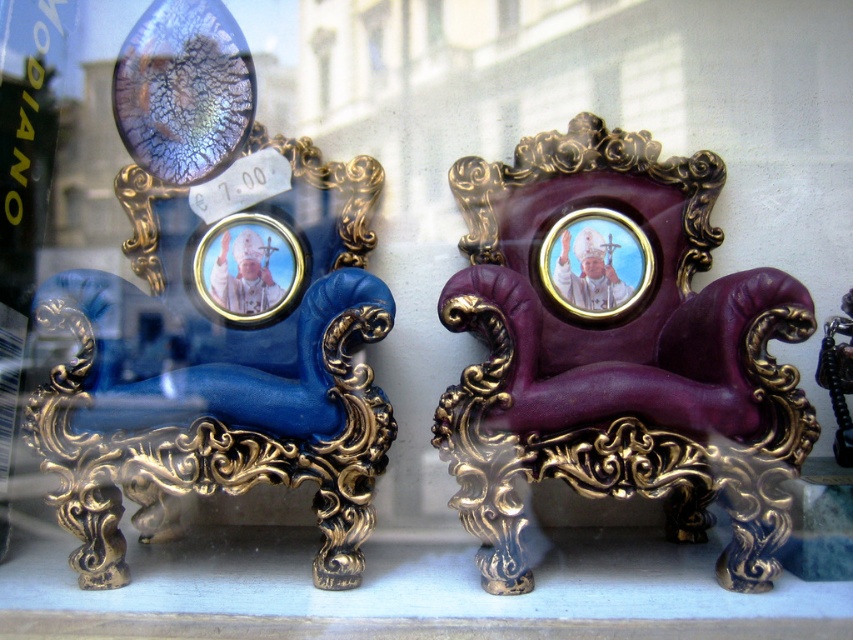
Question: Is purple leather armchair at center to the left of gold metallic picture frame at center from the viewer's perspective?

Choices:
 (A) yes
 (B) no

Answer: (B)

Question: Which object is closer to the camera taking this photo?

Choices:
 (A) purple leather armchair at center
 (B) gold metallic picture frame at center

Answer: (A)

Question: Which of the following is the closest to the observer?

Choices:
 (A) (611, 346)
 (B) (218, 228)

Answer: (A)

Question: Can you confirm if gold-framed picture at center is thinner than gold metallic picture frame at center?

Choices:
 (A) no
 (B) yes

Answer: (A)

Question: Does purple leather armchair at center appear over gold metallic picture frame at center?

Choices:
 (A) no
 (B) yes

Answer: (A)

Question: Which point appears farthest from the camera in this image?

Choices:
 (A) (265, 314)
 (B) (590, 280)

Answer: (B)